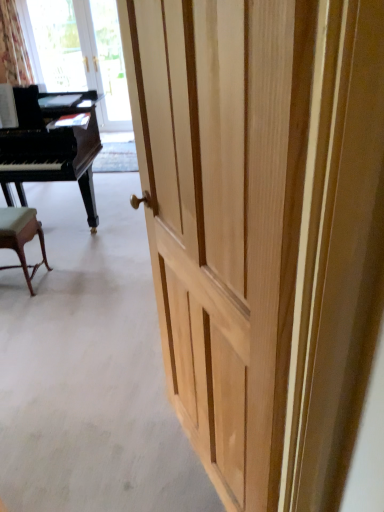
Question: Should I look upward or downward to see floral fabric curtain at upper left?

Choices:
 (A) up
 (B) down

Answer: (A)

Question: Are natural wood door at center and transparent glass door at upper left far apart?

Choices:
 (A) yes
 (B) no

Answer: (A)

Question: Is natural wood door at center aimed at transparent glass door at upper left?

Choices:
 (A) yes
 (B) no

Answer: (B)

Question: Considering the relative sizes of natural wood door at center and transparent glass door at upper left in the image provided, is natural wood door at center bigger than transparent glass door at upper left?

Choices:
 (A) yes
 (B) no

Answer: (B)

Question: Does natural wood door at center have a greater height compared to transparent glass door at upper left?

Choices:
 (A) no
 (B) yes

Answer: (B)

Question: Is natural wood door at center positioned behind transparent glass door at upper left?

Choices:
 (A) yes
 (B) no

Answer: (B)

Question: Does natural wood door at center contain transparent glass door at upper left?

Choices:
 (A) no
 (B) yes

Answer: (A)

Question: Is floral fabric curtain at upper left shorter than green fabric stool at lower left?

Choices:
 (A) no
 (B) yes

Answer: (A)

Question: Is floral fabric curtain at upper left further to camera compared to green fabric stool at lower left?

Choices:
 (A) no
 (B) yes

Answer: (B)

Question: From the image's perspective, is floral fabric curtain at upper left located above green fabric stool at lower left?

Choices:
 (A) no
 (B) yes

Answer: (B)

Question: Does floral fabric curtain at upper left appear on the left side of green fabric stool at lower left?

Choices:
 (A) yes
 (B) no

Answer: (A)

Question: Does floral fabric curtain at upper left have a lesser width compared to green fabric stool at lower left?

Choices:
 (A) yes
 (B) no

Answer: (B)

Question: Is green fabric stool at lower left at the back of floral fabric curtain at upper left?

Choices:
 (A) no
 (B) yes

Answer: (A)

Question: From a real-world perspective, is black polished piano at left positioned under transparent glass door at upper left based on gravity?

Choices:
 (A) no
 (B) yes

Answer: (B)